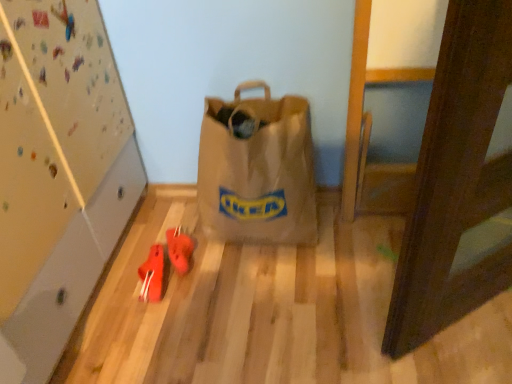
What is the approximate height of rubberized red shoes at center, the 2th footwear viewed from the left?

rubberized red shoes at center, the 2th footwear viewed from the left, is 2.54 inches in height.

At what (x,y) coordinates should I click in order to perform the action: click on rubberized red shoes at lower left, the first footwear when ordered from left to right. Please return your answer as a coordinate pair (x, y). Looking at the image, I should click on (152, 275).

Where is `rubberized red shoes at center, the 2th footwear viewed from the left`? The image size is (512, 384). rubberized red shoes at center, the 2th footwear viewed from the left is located at coordinates pos(179,249).

Identify the location of footwear located on the right of rubberized red shoes at lower left, the first footwear when ordered from left to right. (179, 249).

Is rubberized red shoes at lower left, the first footwear when ordered from left to right, oriented away from rubberized red shoes at center, which is counted as the 1th footwear, starting from the right?

That's not correct — rubberized red shoes at lower left, the first footwear when ordered from left to right, is not looking away from rubberized red shoes at center, which is counted as the 1th footwear, starting from the right.

Is rubberized red shoes at lower left, acting as the 2th footwear starting from the right, at the right side of rubberized red shoes at center, which is counted as the 1th footwear, starting from the right?

Incorrect, rubberized red shoes at lower left, acting as the 2th footwear starting from the right, is not on the right side of rubberized red shoes at center, which is counted as the 1th footwear, starting from the right.

From the image's perspective, which is above, rubberized red shoes at lower left, acting as the 2th footwear starting from the right, or rubberized red shoes at center, which is counted as the 1th footwear, starting from the right?

From the image's view, rubberized red shoes at center, which is counted as the 1th footwear, starting from the right, is above.

Can you confirm if brown paper bag at center is positioned to the left of rubberized red shoes at lower left, the first footwear when ordered from left to right?

No, brown paper bag at center is not to the left of rubberized red shoes at lower left, the first footwear when ordered from left to right.

Is brown paper bag at center turned away from rubberized red shoes at lower left, the first footwear when ordered from left to right?

No, brown paper bag at center is not facing away from rubberized red shoes at lower left, the first footwear when ordered from left to right.

From the picture: Which of these two, brown paper bag at center or rubberized red shoes at lower left, the first footwear when ordered from left to right, is thinner?

Thinner between the two is rubberized red shoes at lower left, the first footwear when ordered from left to right.

Is brown paper bag at center spatially inside rubberized red shoes at lower left, acting as the 2th footwear starting from the right, or outside of it?

brown paper bag at center cannot be found inside rubberized red shoes at lower left, acting as the 2th footwear starting from the right.

Considering the relative positions of rubberized red shoes at lower left, the first footwear when ordered from left to right, and brown paper bag at center in the image provided, is rubberized red shoes at lower left, the first footwear when ordered from left to right, to the right of brown paper bag at center from the viewer's perspective?

Incorrect, rubberized red shoes at lower left, the first footwear when ordered from left to right, is not on the right side of brown paper bag at center.

Is rubberized red shoes at lower left, acting as the 2th footwear starting from the right, not close to brown paper bag at center?

No, rubberized red shoes at lower left, acting as the 2th footwear starting from the right, is not far from brown paper bag at center.

Is rubberized red shoes at lower left, acting as the 2th footwear starting from the right, outside of brown paper bag at center?

That's correct, rubberized red shoes at lower left, acting as the 2th footwear starting from the right, is outside of brown paper bag at center.

From a real-world perspective, between rubberized red shoes at center, which is counted as the 1th footwear, starting from the right, and brown paper bag at center, who is vertically higher?

brown paper bag at center is physically above.

Considering the relative sizes of rubberized red shoes at center, which is counted as the 1th footwear, starting from the right, and brown paper bag at center in the image provided, is rubberized red shoes at center, which is counted as the 1th footwear, starting from the right, smaller than brown paper bag at center?

Correct, rubberized red shoes at center, which is counted as the 1th footwear, starting from the right, occupies less space than brown paper bag at center.

Could you measure the distance between brown paper bag at center and rubberized red shoes at center, the 2th footwear viewed from the left?

brown paper bag at center is 13.19 inches away from rubberized red shoes at center, the 2th footwear viewed from the left.

From the picture: Can you confirm if brown paper bag at center is wider than rubberized red shoes at center, the 2th footwear viewed from the left?

Indeed, brown paper bag at center has a greater width compared to rubberized red shoes at center, the 2th footwear viewed from the left.

From the image's perspective, starting from the brown paper bag at center, which footwear is the 1st one below? Please provide its 2D coordinates.

[(179, 249)]

Is brown paper bag at center shorter than rubberized red shoes at center, which is counted as the 1th footwear, starting from the right?

In fact, brown paper bag at center may be taller than rubberized red shoes at center, which is counted as the 1th footwear, starting from the right.

From the image's perspective, does rubberized red shoes at center, which is counted as the 1th footwear, starting from the right, appear lower than rubberized red shoes at lower left, acting as the 2th footwear starting from the right?

No, from the image's perspective, rubberized red shoes at center, which is counted as the 1th footwear, starting from the right, is not beneath rubberized red shoes at lower left, acting as the 2th footwear starting from the right.

From a real-world perspective, who is located lower, rubberized red shoes at center, the 2th footwear viewed from the left, or rubberized red shoes at lower left, acting as the 2th footwear starting from the right?

rubberized red shoes at lower left, acting as the 2th footwear starting from the right.

Considering the relative positions of rubberized red shoes at center, which is counted as the 1th footwear, starting from the right, and rubberized red shoes at lower left, the first footwear when ordered from left to right, in the image provided, is rubberized red shoes at center, which is counted as the 1th footwear, starting from the right, to the left or to the right of rubberized red shoes at lower left, the first footwear when ordered from left to right,?

Based on their positions, rubberized red shoes at center, which is counted as the 1th footwear, starting from the right, is located to the right of rubberized red shoes at lower left, the first footwear when ordered from left to right.

This screenshot has height=384, width=512. I want to click on footwear located on the left of rubberized red shoes at center, the 2th footwear viewed from the left, so click(x=152, y=275).

In order to click on luggage and bags lying on the right of rubberized red shoes at lower left, acting as the 2th footwear starting from the right in this screenshot , I will do `click(258, 172)`.

Looking at the image, which one is located closer to rubberized red shoes at lower left, acting as the 2th footwear starting from the right, brown paper bag at center or rubberized red shoes at center, which is counted as the 1th footwear, starting from the right?

rubberized red shoes at center, which is counted as the 1th footwear, starting from the right, is closer to rubberized red shoes at lower left, acting as the 2th footwear starting from the right.

In the scene shown: Which object lies nearer to the anchor point rubberized red shoes at lower left, acting as the 2th footwear starting from the right, rubberized red shoes at center, which is counted as the 1th footwear, starting from the right, or brown paper bag at center?

rubberized red shoes at center, which is counted as the 1th footwear, starting from the right, lies closer to rubberized red shoes at lower left, acting as the 2th footwear starting from the right, than the other object.

When comparing their distances from rubberized red shoes at center, the 2th footwear viewed from the left, does rubberized red shoes at lower left, acting as the 2th footwear starting from the right, or brown paper bag at center seem closer?

rubberized red shoes at lower left, acting as the 2th footwear starting from the right, is positioned closer to the anchor rubberized red shoes at center, the 2th footwear viewed from the left.

Which object lies nearer to the anchor point brown paper bag at center, rubberized red shoes at center, which is counted as the 1th footwear, starting from the right, or rubberized red shoes at lower left, acting as the 2th footwear starting from the right?

rubberized red shoes at center, which is counted as the 1th footwear, starting from the right.

When comparing their distances from brown paper bag at center, does rubberized red shoes at lower left, the first footwear when ordered from left to right, or rubberized red shoes at center, the 2th footwear viewed from the left, seem further?

rubberized red shoes at lower left, the first footwear when ordered from left to right, is further to brown paper bag at center.

Considering their positions, is brown paper bag at center positioned further to rubberized red shoes at center, the 2th footwear viewed from the left, than rubberized red shoes at lower left, acting as the 2th footwear starting from the right?

brown paper bag at center is positioned further to the anchor rubberized red shoes at center, the 2th footwear viewed from the left.

Find the location of a particular element. This screenshot has height=384, width=512. footwear between brown paper bag at center and rubberized red shoes at lower left, the first footwear when ordered from left to right, in the vertical direction is located at coordinates (179, 249).